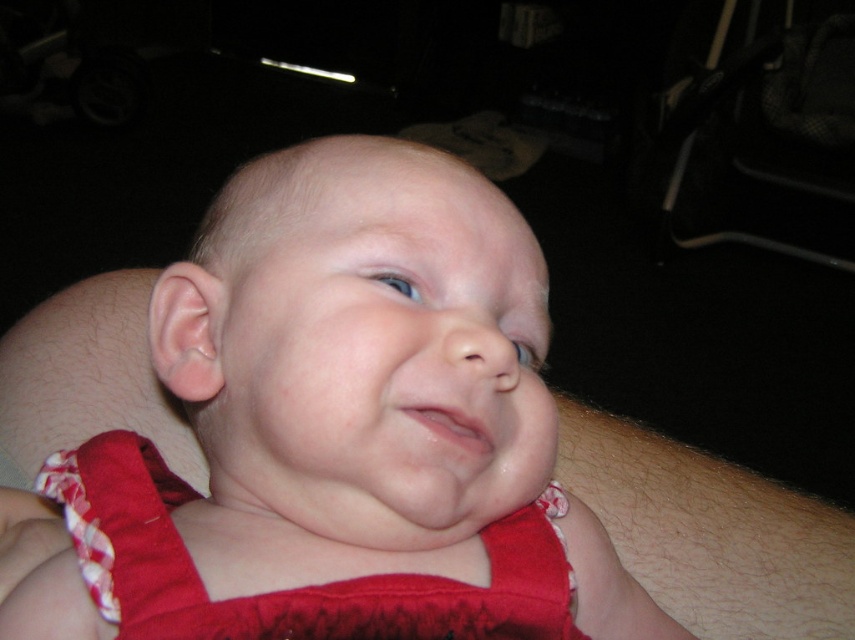
Does red fabric baby at center appear on the left side of red satin dress at center?

No, red fabric baby at center is not to the left of red satin dress at center.

Is red fabric baby at center taller than red satin dress at center?

Correct, red fabric baby at center is much taller as red satin dress at center.

What are the coordinates of `red fabric baby at center` in the screenshot? It's located at (342, 429).

Where is `red fabric baby at center`? The height and width of the screenshot is (640, 855). red fabric baby at center is located at coordinates (342, 429).